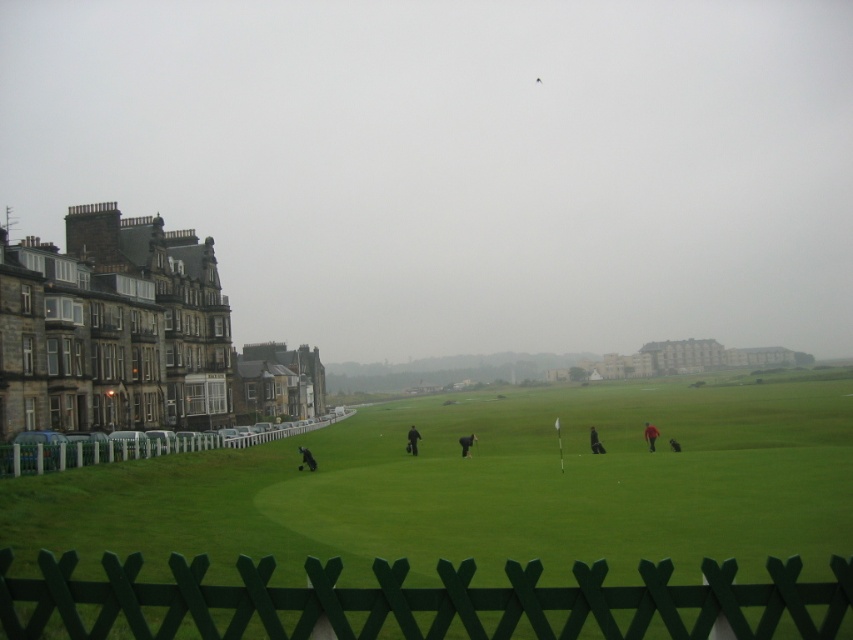
Who is taller, dark gray fabric jacket at center or dark gray jacket at center?

dark gray jacket at center is taller.

Is dark gray fabric jacket at center wider than dark gray jacket at center?

Indeed, dark gray fabric jacket at center has a greater width compared to dark gray jacket at center.

Does point (297, 448) come closer to viewer compared to point (463, 449)?

No, (297, 448) is behind (463, 449).

This screenshot has height=640, width=853. In order to click on dark gray fabric jacket at center in this screenshot , I will do `click(306, 458)`.

Can you confirm if green grassy golf course at center is positioned below dark gray fabric person at center?

Yes, green grassy golf course at center is below dark gray fabric person at center.

Does green grassy golf course at center have a larger size compared to dark gray fabric person at center?

Yes, green grassy golf course at center is bigger than dark gray fabric person at center.

Identify the location of green grassy golf course at center. (480, 490).

Is green grass at center thinner than green wooden fence at left?

No.

Consider the image. Measure the distance between green grass at center and camera.

green grass at center is 129.60 meters away from camera.

Who is more forward, (490, 346) or (257, 436)?

Point (257, 436)

Image resolution: width=853 pixels, height=640 pixels. What are the coordinates of `green grass at center` in the screenshot? It's located at (459, 163).